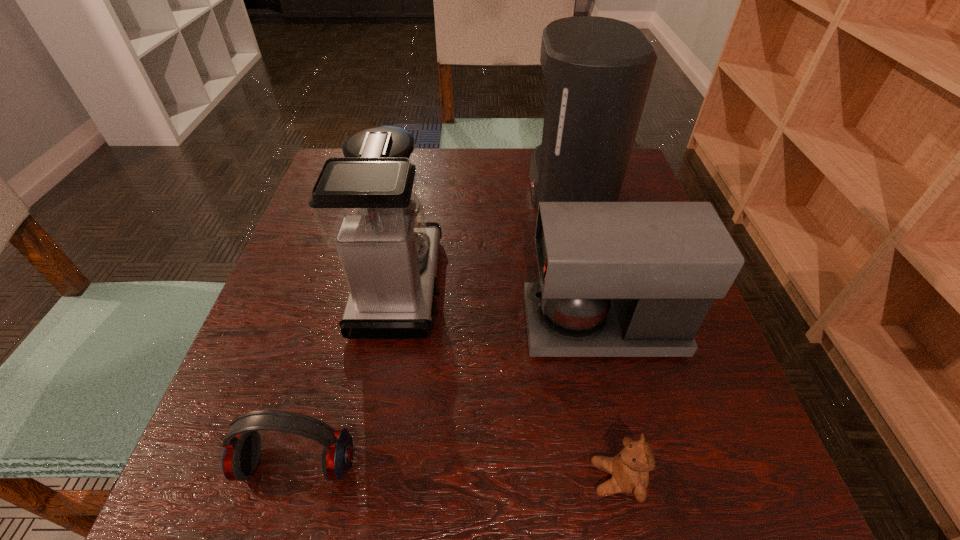
At what (x,y) coordinates should I click in order to perform the action: click on earphone that is positioned at the left edge. Please return your answer as a coordinate pair (x, y). The height and width of the screenshot is (540, 960). Looking at the image, I should click on (242, 446).

Locate an element on the screen. This screenshot has width=960, height=540. object located at the near left corner is located at coordinates (242, 446).

Identify the location of object at the far right corner. The width and height of the screenshot is (960, 540). (598, 70).

In the image, there is a desktop. Identify the location of vacant region at the far edge. (507, 185).

What are the coordinates of `blank space at the near edge of the desktop` in the screenshot? It's located at (565, 457).

Find the location of a particular element. Image resolution: width=960 pixels, height=540 pixels. free region at the left edge is located at coordinates (297, 453).

The image size is (960, 540). In order to click on free location at the right edge of the desktop in this screenshot , I will do `click(709, 397)`.

The height and width of the screenshot is (540, 960). I want to click on free space that is in between the shortest coffee maker and the shortest object, so click(x=610, y=402).

This screenshot has height=540, width=960. Find the location of `free space between the second tallest coffee maker and the shortest coffee maker`. free space between the second tallest coffee maker and the shortest coffee maker is located at coordinates point(501,306).

Locate an element on the screen. The image size is (960, 540). free space that is in between the shortest object and the third tallest object is located at coordinates (610, 402).